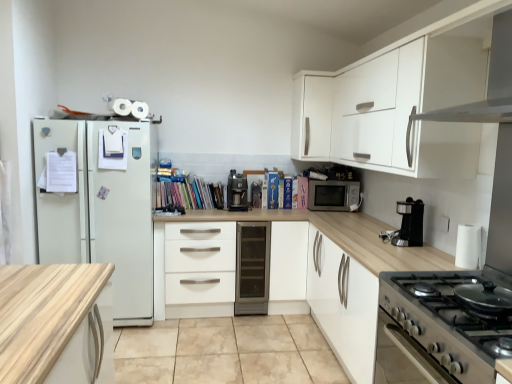
Question: Based on their positions, is white matte drawer at center located to the left or right of white matte cabinet at upper right?

Choices:
 (A) right
 (B) left

Answer: (B)

Question: Would you say white matte drawer at center is inside or outside white matte cabinet at upper right?

Choices:
 (A) outside
 (B) inside

Answer: (A)

Question: Based on their relative distances, which object is farther from the stainless steel gas stove at lower right?

Choices:
 (A) white matte drawer at center
 (B) satin silver microwave at center
 (C) satin black coffee machine at center
 (D) beige tile at center
 (E) beige matte oven at lower right

Answer: (C)

Question: Which of these objects is positioned closest to the multicolored paperbacks at center?

Choices:
 (A) white matte cabinet at upper right
 (B) white matte drawer at center
 (C) satin silver microwave at center
 (D) stainless steel gas stove at lower right
 (E) satin black coffee machine at center

Answer: (E)